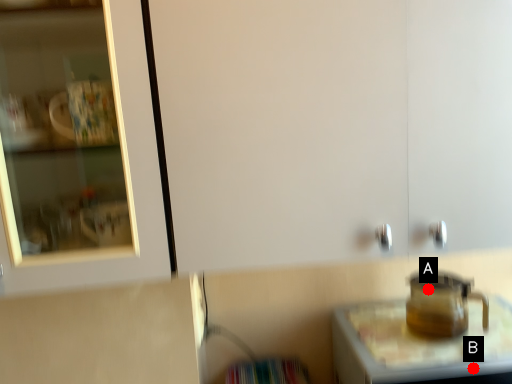
Question: Two points are circled on the image, labeled by A and B beside each circle. Which point is closer to the camera?

Choices:
 (A) A is closer
 (B) B is closer

Answer: (B)